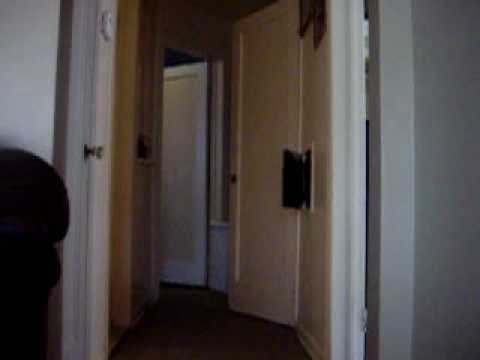
Locate an element on the screen. The width and height of the screenshot is (480, 360). wall is located at coordinates (314, 248).